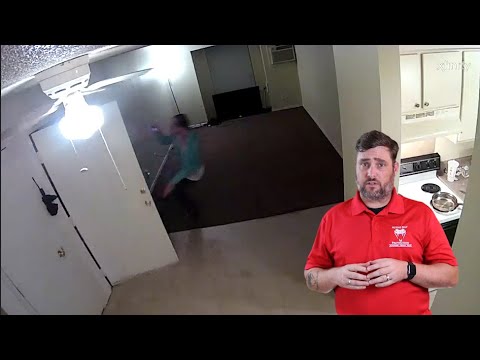
Find the location of a particular element. The image size is (480, 360). door knob where you open door is located at coordinates (146, 201).